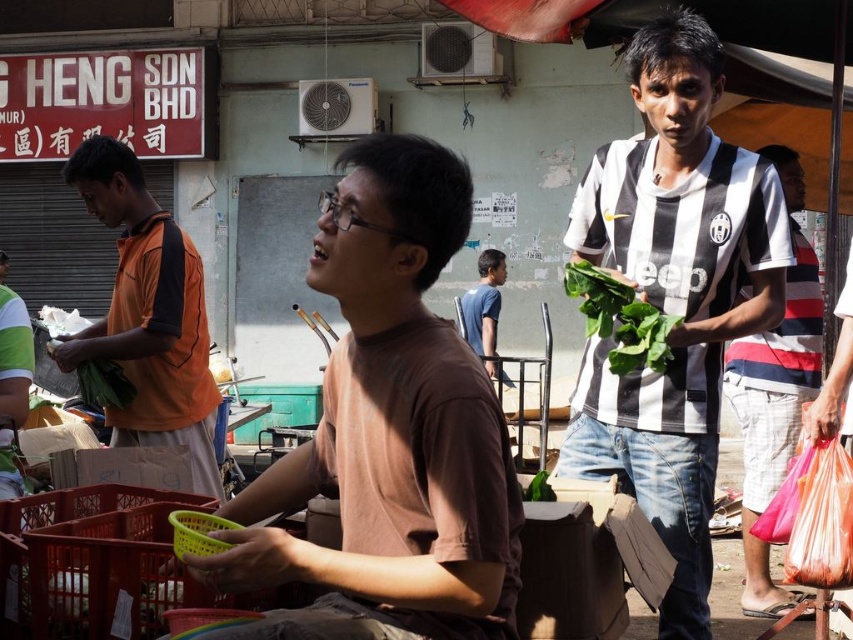
Does black and white striped shirt at center have a larger size compared to green leafy vegetable at center?

Correct, black and white striped shirt at center is larger in size than green leafy vegetable at center.

Can you confirm if black and white striped shirt at center is positioned above green leafy vegetable at center?

No.

Between point (683, 568) and point (593, 276), which one is positioned in front?

Point (593, 276)

I want to click on black and white striped shirt at center, so click(674, 296).

Can you confirm if brown matte shirt at center is thinner than blue matte shirt at center?

In fact, brown matte shirt at center might be wider than blue matte shirt at center.

Is point (395, 156) in front of point (486, 253)?

Yes, point (395, 156) is in front of point (486, 253).

Describe the element at coordinates (387, 432) in the screenshot. I see `brown matte shirt at center` at that location.

At what (x,y) coordinates should I click in order to perform the action: click on brown matte shirt at center. Please return your answer as a coordinate pair (x, y). The width and height of the screenshot is (853, 640). Looking at the image, I should click on (387, 432).

Is black and white striped shirt at center to the left of orange fabric shirt at left from the viewer's perspective?

No, black and white striped shirt at center is not to the left of orange fabric shirt at left.

Between point (664, 529) and point (173, 371), which one is positioned in front?

Point (664, 529) is more forward.

Where is `black and white striped shirt at center`? black and white striped shirt at center is located at coordinates pyautogui.click(x=674, y=296).